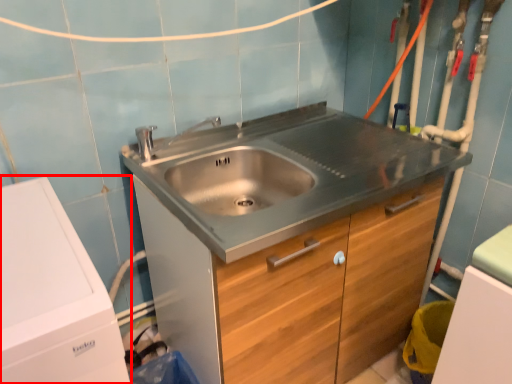
Question: From the image's perspective, what is the correct spatial positioning of washing machine (annotated by the red box) in reference to cabinetry?

Choices:
 (A) below
 (B) above

Answer: (A)